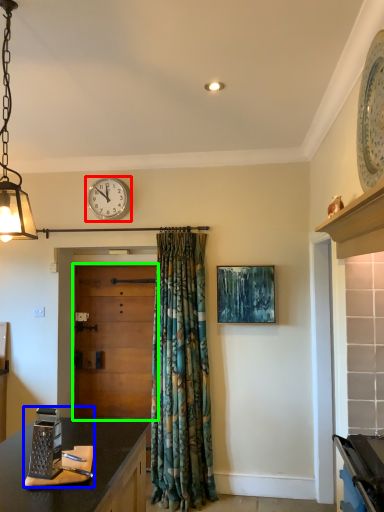
Question: Based on their relative distances, which object is nearer to wall clock (highlighted by a red box)? Choose from appliance (highlighted by a blue box) and door (highlighted by a green box).

Choices:
 (A) appliance
 (B) door

Answer: (B)